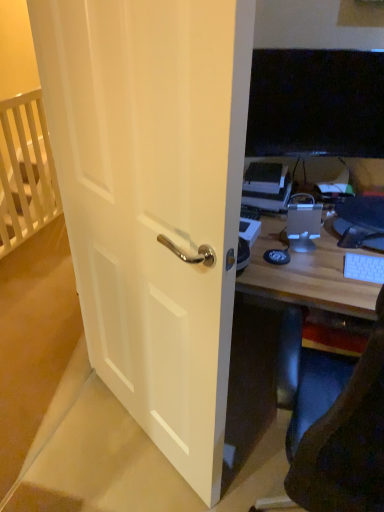
Where is `free location above white plastic keyboard at right (from a real-world perspective)`? Image resolution: width=384 pixels, height=512 pixels. free location above white plastic keyboard at right (from a real-world perspective) is located at coordinates (368, 265).